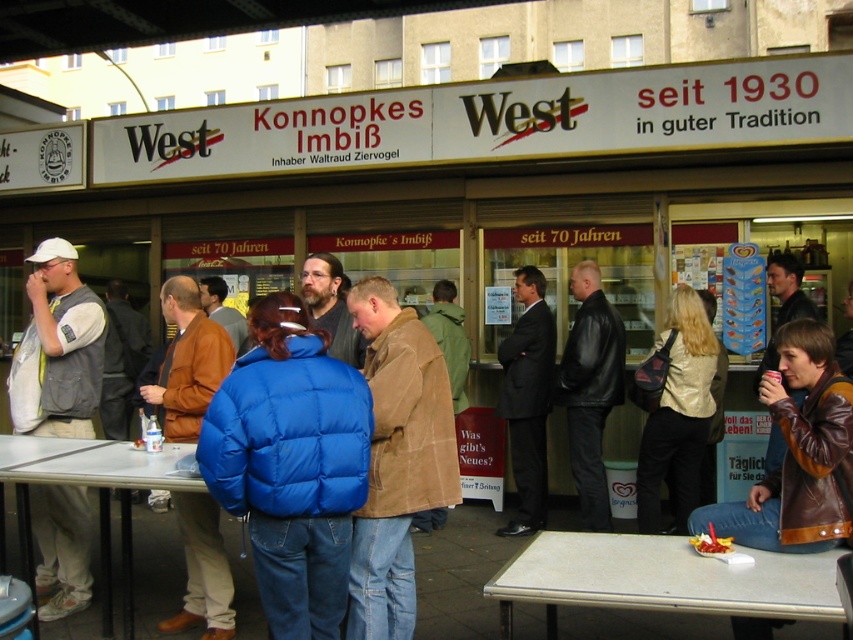
Question: Can you confirm if puffy blue jacket at center is positioned below white laminate table at lower right?

Choices:
 (A) no
 (B) yes

Answer: (A)

Question: Does white laminate table at lower right lie behind smooth plastic chips at center?

Choices:
 (A) yes
 (B) no

Answer: (B)

Question: Which point appears closest to the camera in this image?

Choices:
 (A) (506, 586)
 (B) (316, 552)
 (C) (666, 429)

Answer: (A)

Question: Which point is farther to the camera?

Choices:
 (A) (717, 548)
 (B) (689, 554)
 (C) (360, 609)
 (D) (129, 540)

Answer: (D)

Question: Which point is farther to the camera?

Choices:
 (A) metallic silver table at lower left
 (B) brown leather jacket at lower right
 (C) white laminate table at lower right

Answer: (A)

Question: Does white laminate table at lower right have a lesser width compared to brown leather jacket at lower right?

Choices:
 (A) yes
 (B) no

Answer: (B)